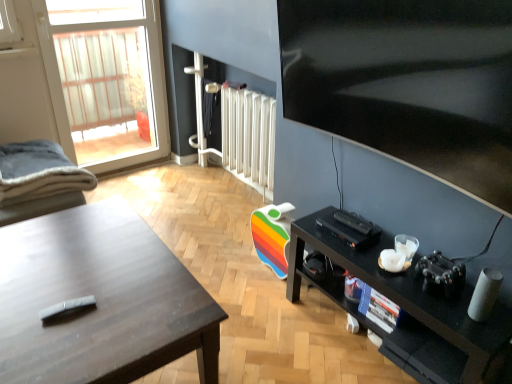
Question: Is transparent glass door at upper left further to camera compared to metallic silver screen door at upper center?

Choices:
 (A) yes
 (B) no

Answer: (B)

Question: Is transparent glass door at upper left shorter than metallic silver screen door at upper center?

Choices:
 (A) yes
 (B) no

Answer: (B)

Question: From a real-world perspective, is transparent glass door at upper left physically above metallic silver screen door at upper center?

Choices:
 (A) yes
 (B) no

Answer: (A)

Question: From the image's perspective, is transparent glass door at upper left located beneath metallic silver screen door at upper center?

Choices:
 (A) yes
 (B) no

Answer: (B)

Question: From the image's perspective, is transparent glass door at upper left on top of metallic silver screen door at upper center?

Choices:
 (A) no
 (B) yes

Answer: (B)

Question: Considering the relative sizes of transparent glass door at upper left and metallic silver screen door at upper center in the image provided, is transparent glass door at upper left smaller than metallic silver screen door at upper center?

Choices:
 (A) yes
 (B) no

Answer: (B)

Question: From the image's perspective, is black matte shelf at lower right on metallic silver screen door at upper center?

Choices:
 (A) no
 (B) yes

Answer: (A)

Question: From a real-world perspective, is black matte shelf at lower right positioned over metallic silver screen door at upper center based on gravity?

Choices:
 (A) yes
 (B) no

Answer: (B)

Question: Can you confirm if black matte shelf at lower right is shorter than metallic silver screen door at upper center?

Choices:
 (A) no
 (B) yes

Answer: (B)

Question: Is black matte shelf at lower right to the right of metallic silver screen door at upper center from the viewer's perspective?

Choices:
 (A) no
 (B) yes

Answer: (B)

Question: Can you confirm if black matte shelf at lower right is thinner than metallic silver screen door at upper center?

Choices:
 (A) no
 (B) yes

Answer: (A)

Question: Does black matte shelf at lower right lie in front of metallic silver screen door at upper center?

Choices:
 (A) yes
 (B) no

Answer: (A)

Question: Is matte black desk at left looking in the opposite direction of metallic silver screen door at upper center?

Choices:
 (A) yes
 (B) no

Answer: (B)